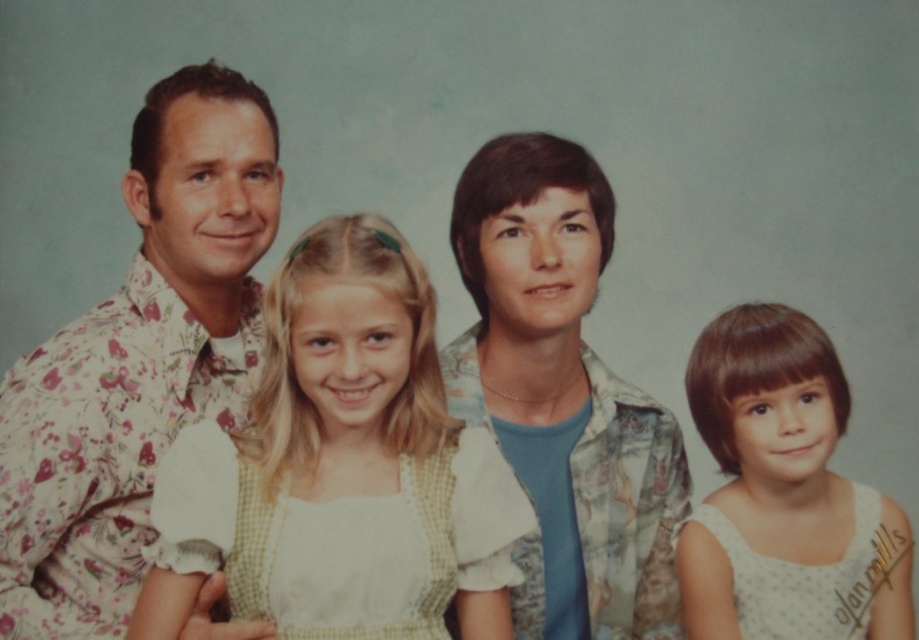
Question: Which point is farther to the camera?

Choices:
 (A) white checkered dress at center
 (B) white dotted dress at lower right
 (C) floral-patterned shirt at left
 (D) camouflage-patterned shirt at center

Answer: (D)

Question: Is floral-patterned shirt at left below white dotted dress at lower right?

Choices:
 (A) no
 (B) yes

Answer: (A)

Question: Is floral-patterned shirt at left to the right of white checkered dress at center from the viewer's perspective?

Choices:
 (A) yes
 (B) no

Answer: (B)

Question: Is camouflage-patterned shirt at center bigger than white dotted dress at lower right?

Choices:
 (A) yes
 (B) no

Answer: (A)

Question: Which is farther from the camouflage-patterned shirt at center?

Choices:
 (A) white dotted dress at lower right
 (B) white checkered dress at center
 (C) floral-patterned shirt at left

Answer: (C)

Question: Among these points, which one is farthest from the camera?

Choices:
 (A) (603, 536)
 (B) (440, 378)
 (C) (10, 554)
 (D) (865, 499)

Answer: (A)